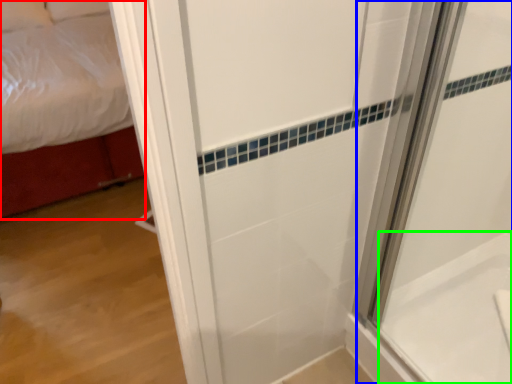
Question: Based on their relative distances, which object is nearer to bed (highlighted by a red box)? Choose from shower door (highlighted by a blue box) and bath (highlighted by a green box).

Choices:
 (A) shower door
 (B) bath

Answer: (A)